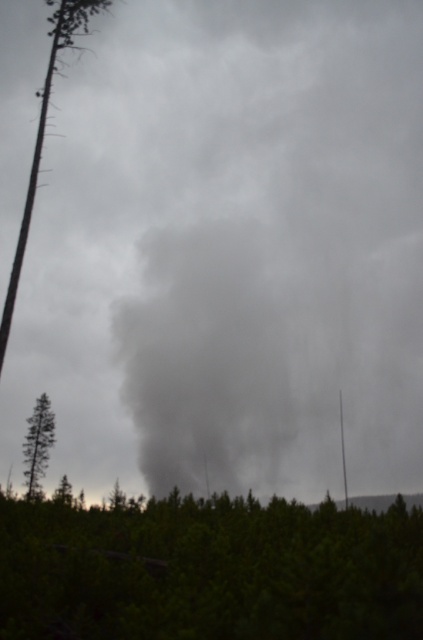
You are a hiker trying to determine which tree is nearer to you. You see a smooth bark tree at left and a green matte tree at left. Which one is closer?

The smooth bark tree at left is closer to you than the green matte tree at left.

You are a firefighter assessing the scene. You notice two trees in the foreground, the smooth bark tree at left and the green matte tree at left. Which tree is positioned more to the right side of the scene?

The smooth bark tree at left is positioned more to the right side of the scene compared to the green matte tree at left.